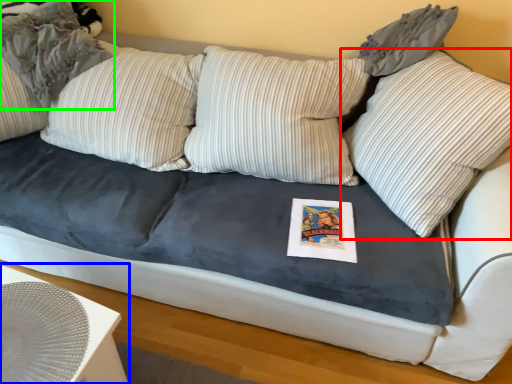
Question: Considering the real-world distances, which object is farthest from pillow (highlighted by a red box)? table (highlighted by a blue box) or pillow (highlighted by a green box)?

Choices:
 (A) table
 (B) pillow

Answer: (B)